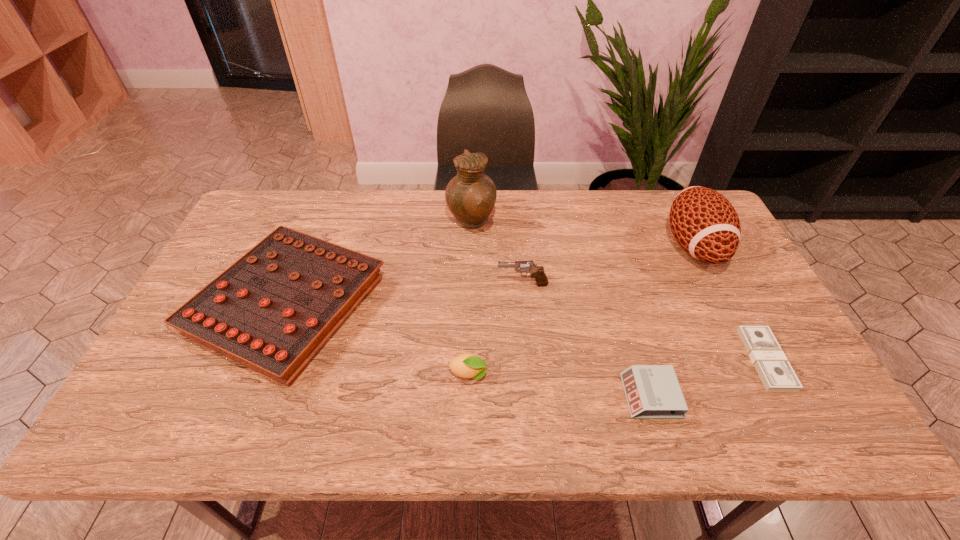
Where is `free region located 0.200m on the front of the sixth shortest object`? The height and width of the screenshot is (540, 960). free region located 0.200m on the front of the sixth shortest object is located at coordinates (740, 339).

Locate an element on the screen. This screenshot has height=540, width=960. free point located 0.380m at the barrel of the fifth shortest object is located at coordinates (365, 285).

Locate an element on the screen. The height and width of the screenshot is (540, 960). free point located 0.110m at the barrel of the fifth shortest object is located at coordinates point(459,285).

Image resolution: width=960 pixels, height=540 pixels. Identify the location of vacant region located at the barrel of the fifth shortest object. [431, 285].

Where is `vacant space located 0.380m on the right of the leftmost object`? Image resolution: width=960 pixels, height=540 pixels. vacant space located 0.380m on the right of the leftmost object is located at coordinates (519, 307).

Identify the location of vacant area situated 0.170m with leaves positioned above the lemon. Image resolution: width=960 pixels, height=540 pixels. (560, 374).

Where is `free space located on the back of the second shortest object`? This screenshot has height=540, width=960. free space located on the back of the second shortest object is located at coordinates (618, 287).

This screenshot has width=960, height=540. Find the location of `vacant space positioned on the left of the dollar`. vacant space positioned on the left of the dollar is located at coordinates (621, 359).

Find the location of a particular element. This screenshot has height=540, width=960. pitcher present at the far edge is located at coordinates (471, 195).

Identify the location of football situated at the far edge. Image resolution: width=960 pixels, height=540 pixels. (704, 223).